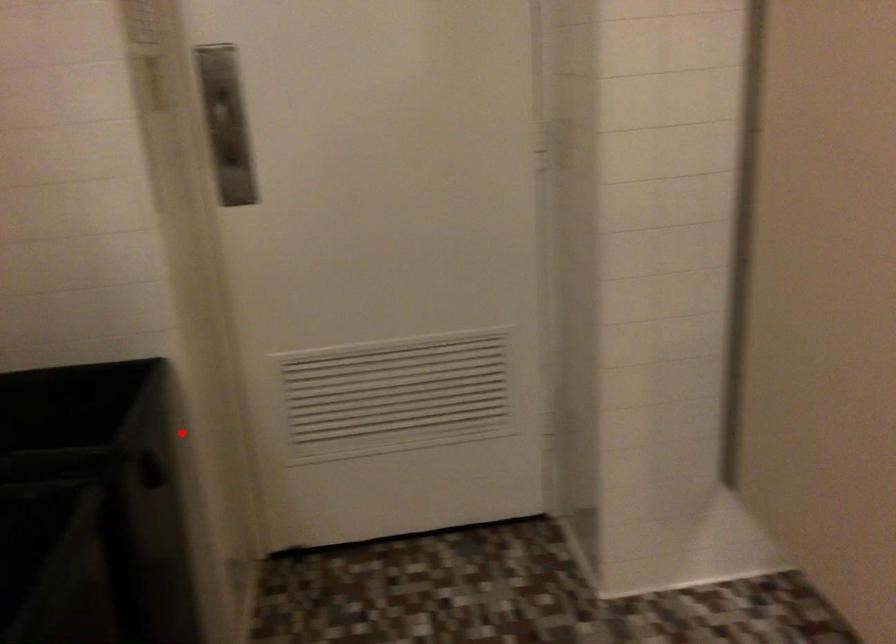
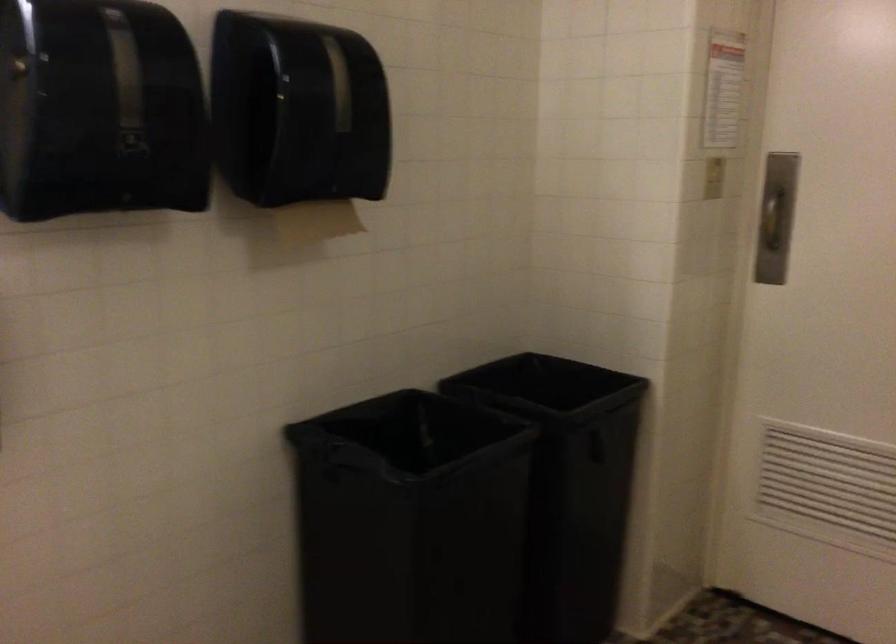
In the second image, find the point that corresponds to the highlighted location in the first image.

(647, 438)